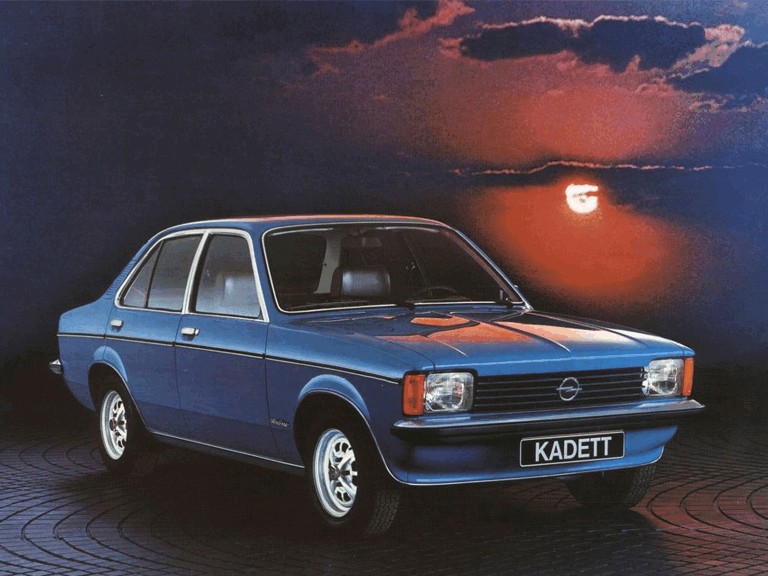
Find the location of a particular element. The height and width of the screenshot is (576, 768). windows is located at coordinates (133, 291), (167, 276), (220, 267), (448, 257), (398, 256), (352, 253), (293, 245).